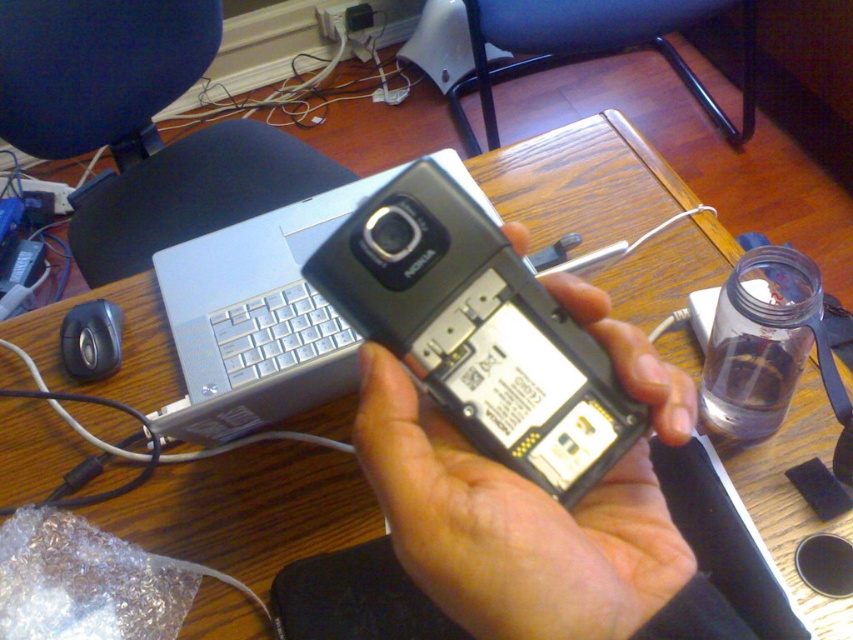
Question: Can you confirm if metallic silver phone at center is positioned to the left of clear glass bottle at right?

Choices:
 (A) no
 (B) yes

Answer: (B)

Question: Can you confirm if metallic silver phone at center is positioned below clear glass bottle at right?

Choices:
 (A) no
 (B) yes

Answer: (B)

Question: Which point is closer to the camera?

Choices:
 (A) clear glass bottle at right
 (B) metallic silver phone at center

Answer: (B)

Question: Among these points, which one is farthest from the camera?

Choices:
 (A) (448, 536)
 (B) (798, 276)

Answer: (B)

Question: Is metallic silver phone at center thinner than clear glass bottle at right?

Choices:
 (A) yes
 (B) no

Answer: (B)

Question: Which object appears closest to the camera in this image?

Choices:
 (A) clear glass bottle at right
 (B) metallic silver phone at center

Answer: (B)